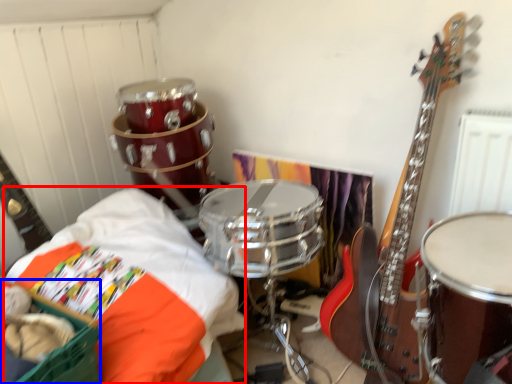
Question: Among these objects, which one is nearest to the camera, sheet (highlighted by a red box) or basket (highlighted by a blue box)?

Choices:
 (A) sheet
 (B) basket

Answer: (B)